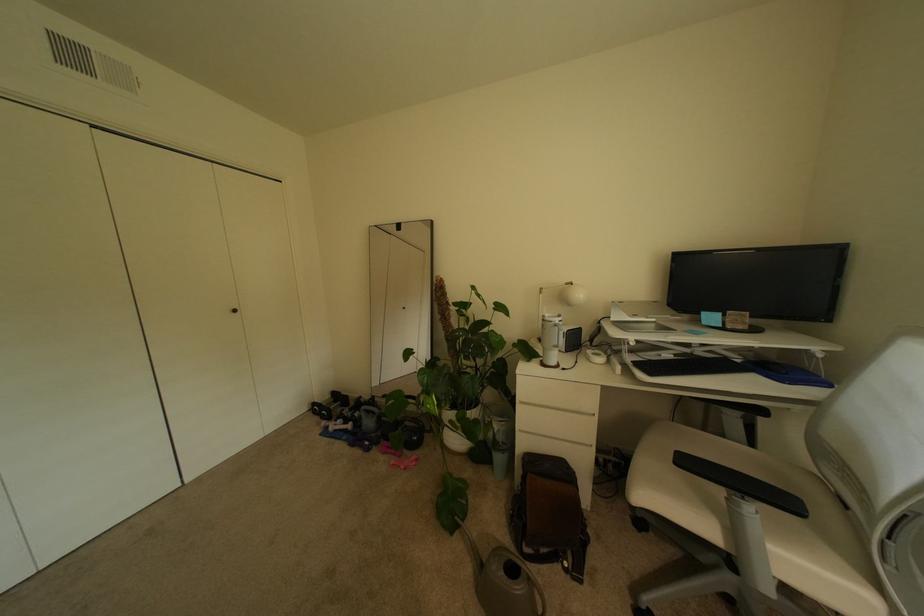
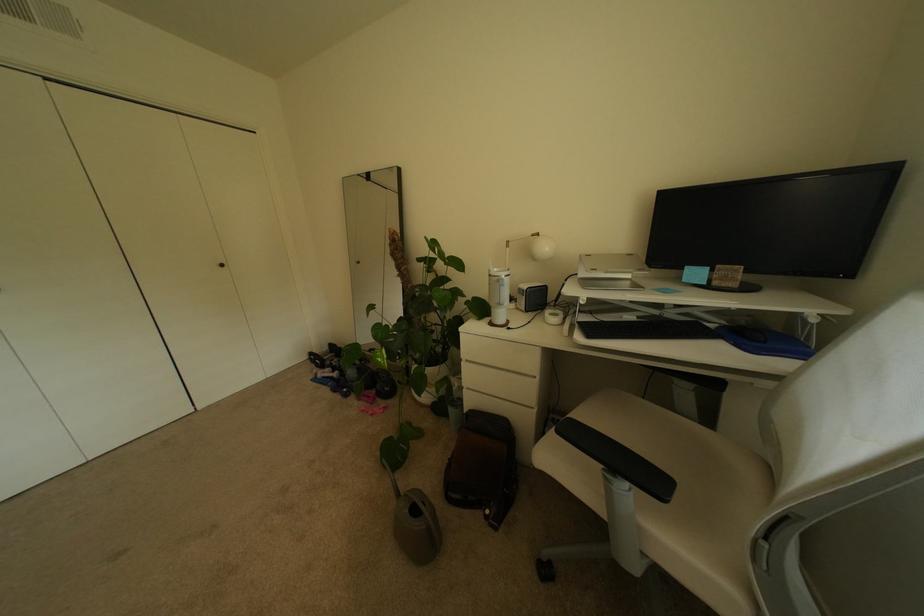
Locate, in the second image, the point that corresponds to point (659, 375) in the first image.

(598, 337)